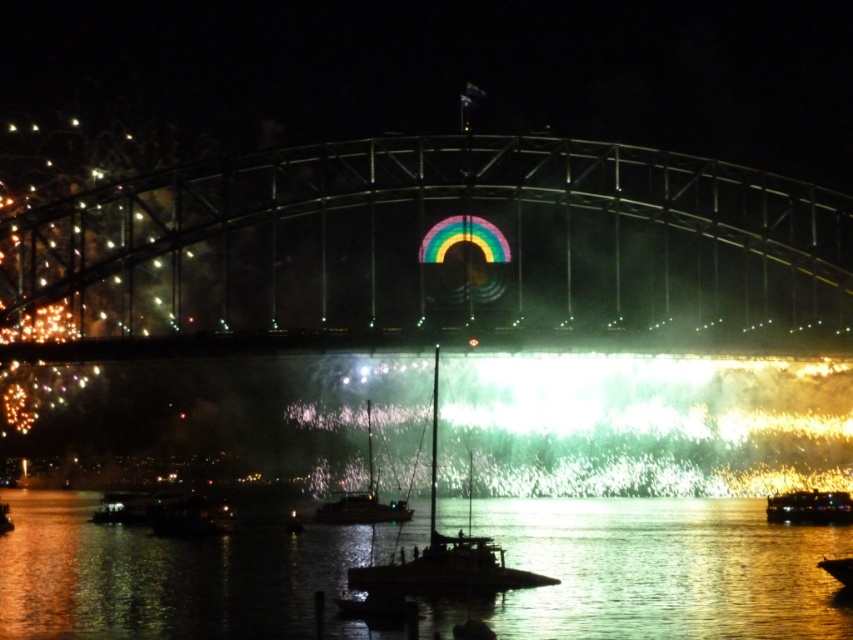
Is metallic bridge at center thinner than metallic sailboat at center?

No.

Does metallic bridge at center lie behind metallic sailboat at center?

Yes, it is.

What do you see at coordinates (428, 253) in the screenshot? This screenshot has width=853, height=640. I see `metallic bridge at center` at bounding box center [428, 253].

Locate an element on the screen. This screenshot has width=853, height=640. metallic bridge at center is located at coordinates (428, 253).

Who is more forward, (712, 168) or (843, 563)?

Point (843, 563) is in front.

How far apart are metallic bridge at center and metallic gold boat at lower right?

metallic bridge at center is 158.81 feet from metallic gold boat at lower right.

Is point (54, 284) closer to camera compared to point (842, 570)?

No, it is behind (842, 570).

Locate an element on the screen. The image size is (853, 640). metallic bridge at center is located at coordinates (428, 253).

Is metallic sailboat at center behind shiny metallic sailboat at center?

That is False.

Is metallic sailboat at center to the right of shiny metallic sailboat at center from the viewer's perspective?

Correct, you'll find metallic sailboat at center to the right of shiny metallic sailboat at center.

Who is more forward, (509, 586) or (367, 449)?

Point (509, 586) is more forward.

Where is `metallic sailboat at center`? Image resolution: width=853 pixels, height=640 pixels. metallic sailboat at center is located at coordinates (444, 554).